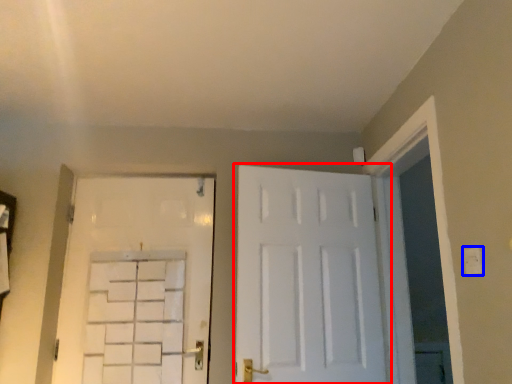
Question: Which point is further to the camera, door (highlighted by a red box) or electric outlet (highlighted by a blue box)?

Choices:
 (A) door
 (B) electric outlet

Answer: (A)